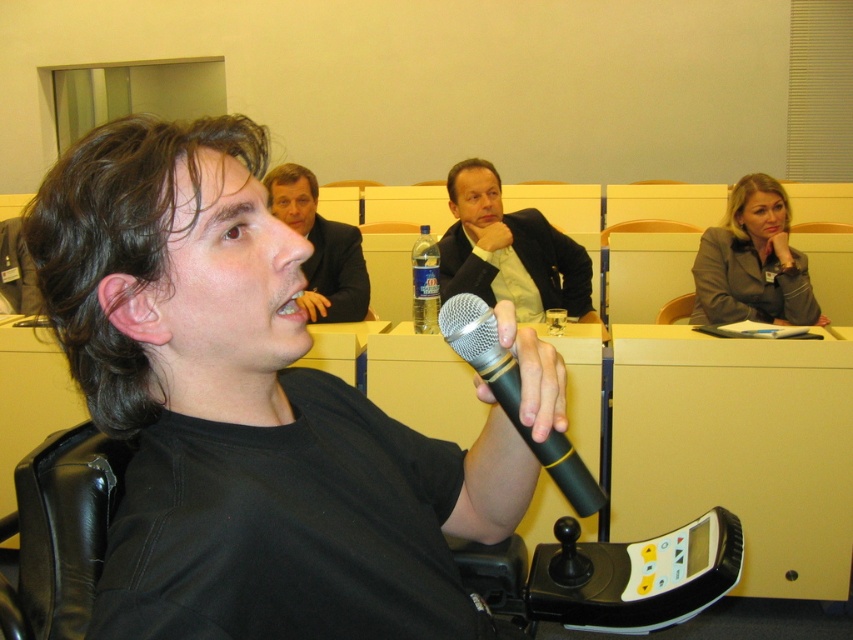
You are an event planner organizing a panel discussion and need to arrange seating based on the attire of the attendees. The attendees are wearing a matte gray blazer at upper right and a light brown suit at upper center. According to the image, which attendee should be seated closer to the front of the room?

The matte gray blazer at upper right should be seated closer to the front because it is located below the light brown suit at upper center in the image, indicating they are positioned lower in the frame and thus closer to the front.

You are attending a conference and see the light brown suit at upper center and the black rubber microphone at center. Which object is positioned higher in the image?

The light brown suit at upper center is positioned higher than the black rubber microphone at center.